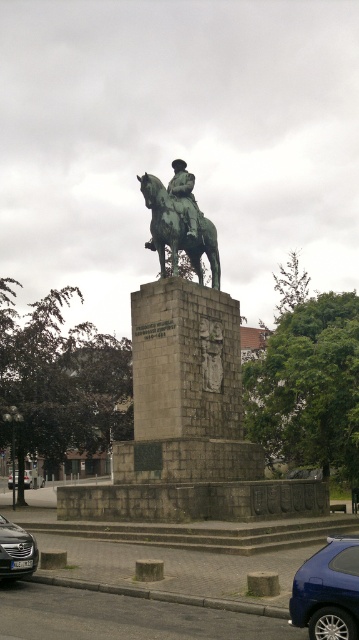
Does point (188, 360) come behind point (151, 232)?

No.

Which is above, green polished stone statue at center or green polished metal horse at center?

green polished metal horse at center

Image resolution: width=359 pixels, height=640 pixels. What do you see at coordinates (187, 426) in the screenshot?
I see `green polished stone statue at center` at bounding box center [187, 426].

Image resolution: width=359 pixels, height=640 pixels. What are the coordinates of `green polished stone statue at center` in the screenshot? It's located at [x=187, y=426].

Consider the image. Does green polished stone statue at center come in front of bronze statue at center?

Yes.

Who is positioned more to the right, green polished stone statue at center or bronze statue at center?

green polished stone statue at center

Is point (142, 179) closer to camera compared to point (192, 198)?

Yes, point (142, 179) is closer to viewer.

Locate an element on the screen. This screenshot has width=359, height=640. green polished stone statue at center is located at coordinates (187, 426).

From the picture: Is green polished stone statue at center smaller than metallic silver car at lower left?

Actually, green polished stone statue at center might be larger than metallic silver car at lower left.

Does green polished stone statue at center have a lesser height compared to metallic silver car at lower left?

No.

You are a GUI agent. You are given a task and a screenshot of the screen. Output one action in this format:
    pyautogui.click(x=<x>, y=<y>)
    Task: Click on the green polished stone statue at center
    
    Given the screenshot: What is the action you would take?
    pyautogui.click(x=187, y=426)